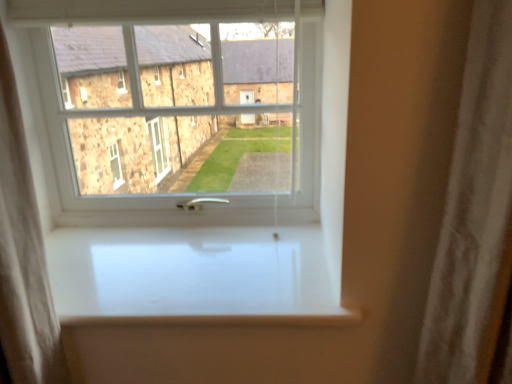
Question: From the image's perspective, is white glossy window sill at center located above or below white plastic window at center?

Choices:
 (A) above
 (B) below

Answer: (B)

Question: Does point click(98, 299) appear closer or farther from the camera than point click(226, 38)?

Choices:
 (A) farther
 (B) closer

Answer: (B)

Question: Based on their positions, is white glossy window sill at center located to the left or right of white plastic window at center?

Choices:
 (A) right
 (B) left

Answer: (A)

Question: Considering the relative positions of white plastic window at center and white glossy window sill at center in the image provided, is white plastic window at center to the left or to the right of white glossy window sill at center?

Choices:
 (A) left
 (B) right

Answer: (A)

Question: From the image's perspective, is white plastic window at center positioned above or below white glossy window sill at center?

Choices:
 (A) below
 (B) above

Answer: (B)

Question: From a real-world perspective, relative to white glossy window sill at center, is white plastic window at center vertically above or below?

Choices:
 (A) below
 (B) above

Answer: (B)

Question: Based on their sizes in the image, would you say white plastic window at center is bigger or smaller than white glossy window sill at center?

Choices:
 (A) small
 (B) big

Answer: (B)